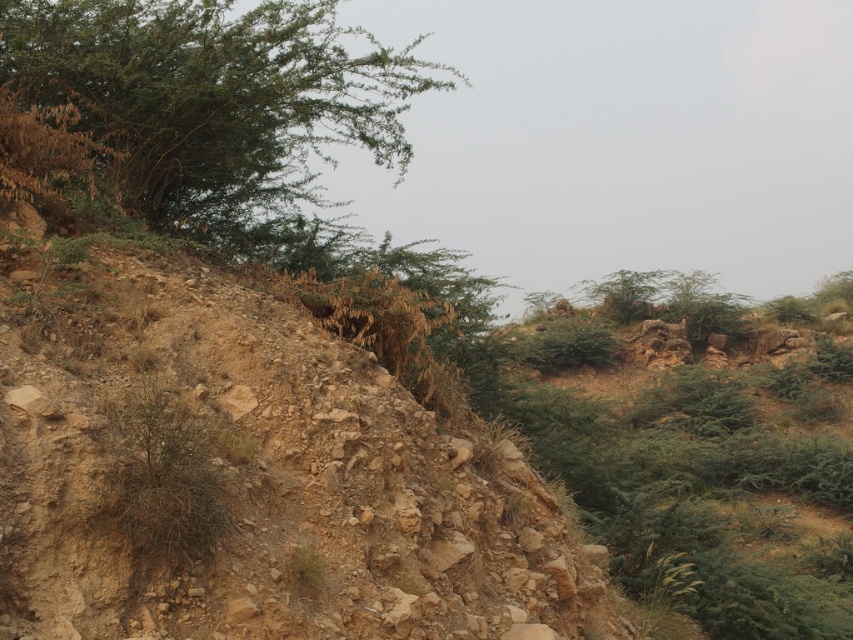
Question: Does dull brown dirt at center appear over green leafy shrubs at upper center?

Choices:
 (A) yes
 (B) no

Answer: (A)

Question: Which of the following is the farthest from the observer?

Choices:
 (A) (440, 468)
 (B) (157, 125)
 (C) (846, 596)

Answer: (C)

Question: Which of these objects is positioned closest to the green leafy shrub at upper left?

Choices:
 (A) dull brown dirt at center
 (B) green leafy shrubs at upper center

Answer: (A)

Question: Can you confirm if green leafy shrubs at upper center is positioned below green leafy shrub at upper left?

Choices:
 (A) yes
 (B) no

Answer: (A)

Question: Is dull brown dirt at center to the right of green leafy shrub at upper left from the viewer's perspective?

Choices:
 (A) yes
 (B) no

Answer: (A)

Question: Which point is closer to the camera taking this photo?

Choices:
 (A) (231, 205)
 (B) (672, 493)

Answer: (A)